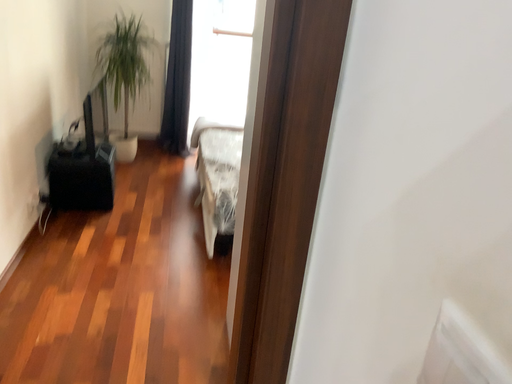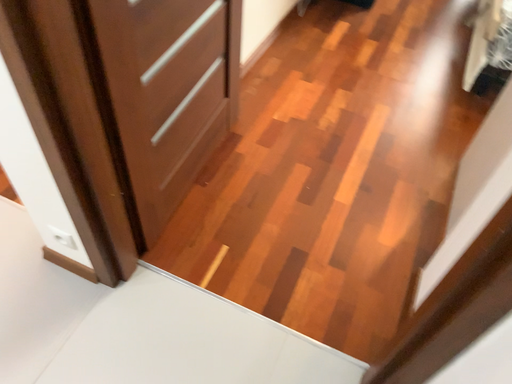
Question: Which way did the camera rotate in the video?

Choices:
 (A) rotated upward
 (B) rotated downward

Answer: (B)